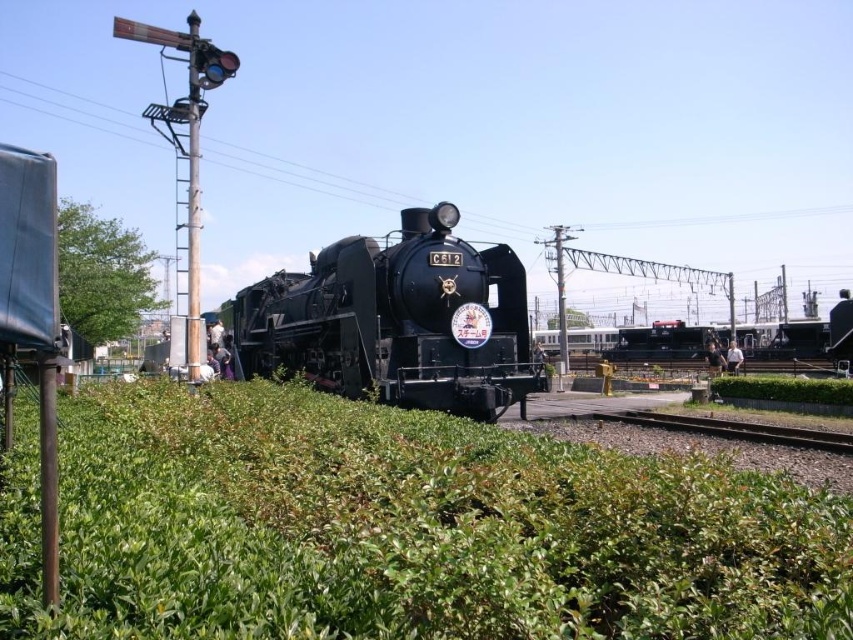
You are standing at the point marked by coordinates (401, 529) in the image. What object are you directly facing?

The point marked by coordinates (401, 529) is directly facing the green leafy hedge at center.

What are the coordinates of the black polished steam engine at center?

The coordinates of the black polished steam engine at center are at point (397, 321).

You are a railway inspector checking the space between the green leafy hedge at center and the black polished steam engine at center. Which object takes up more space in the scene?

The black polished steam engine at center occupies more space than the green leafy hedge at center.